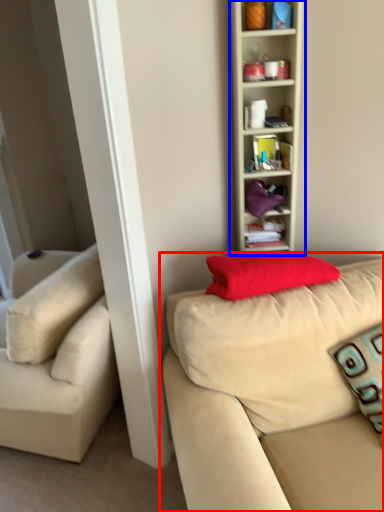
Question: Which object is further to the camera taking this photo, studio couch (highlighted by a red box) or shelf (highlighted by a blue box)?

Choices:
 (A) studio couch
 (B) shelf

Answer: (B)